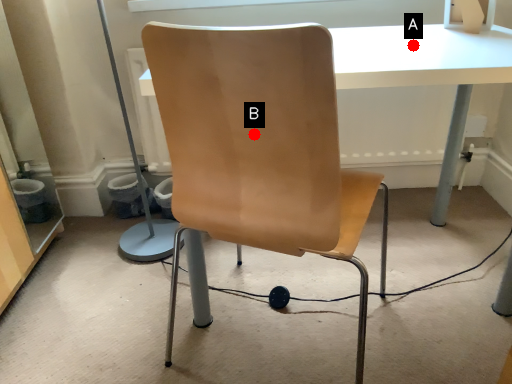
Question: Two points are circled on the image, labeled by A and B beside each circle. Which point is farther from the camera taking this photo?

Choices:
 (A) A is further
 (B) B is further

Answer: (A)